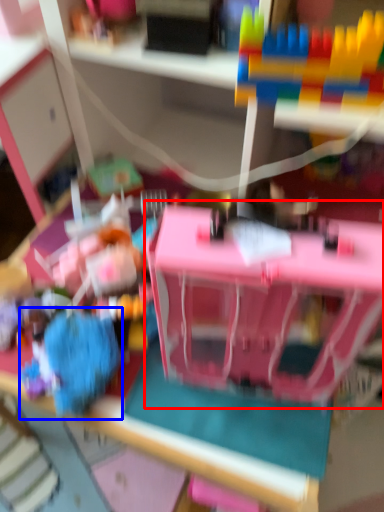
Question: Which point is closer to the camera, toy (highlighted by a red box) or toy (highlighted by a blue box)?

Choices:
 (A) toy
 (B) toy

Answer: (A)